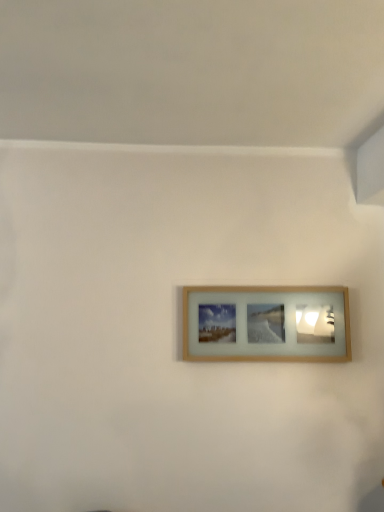
Locate an element on the screen. The height and width of the screenshot is (512, 384). wooden picture frame at center is located at coordinates (266, 324).

The width and height of the screenshot is (384, 512). What do you see at coordinates (266, 324) in the screenshot?
I see `wooden picture frame at center` at bounding box center [266, 324].

Where is `wooden picture frame at center`? This screenshot has width=384, height=512. wooden picture frame at center is located at coordinates (266, 324).